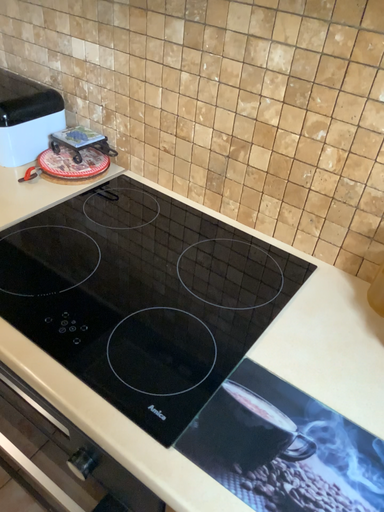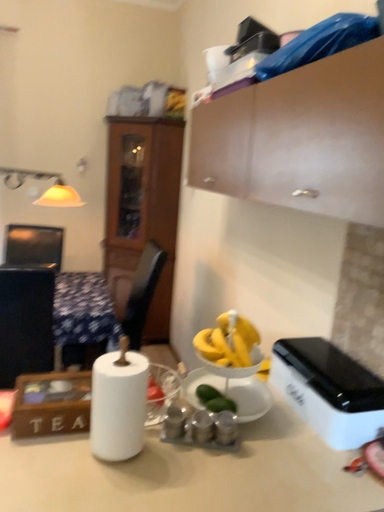
Question: Which way did the camera rotate in the video?

Choices:
 (A) rotated right
 (B) rotated left

Answer: (B)